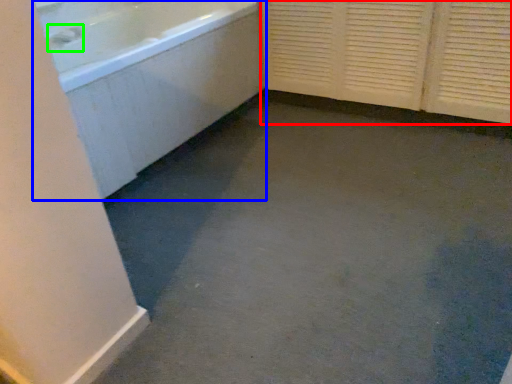
Question: Which object is positioned farthest from screen door (highlighted by a red box)? Select from bathtub (highlighted by a blue box) and faucet (highlighted by a green box).

Choices:
 (A) bathtub
 (B) faucet

Answer: (B)